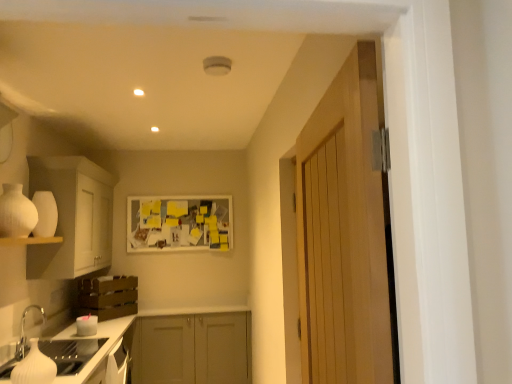
Question: From a real-world perspective, is brown wooden crate at lower left, which appears as the second cabinetry when viewed from the top, physically above wooden door at right?

Choices:
 (A) yes
 (B) no

Answer: (B)

Question: Is brown wooden crate at lower left, which appears as the second cabinetry when viewed from the top, not within wooden door at right?

Choices:
 (A) no
 (B) yes

Answer: (B)

Question: Does brown wooden crate at lower left, which is counted as the second cabinetry, starting from the bottom, appear on the left side of wooden door at right?

Choices:
 (A) yes
 (B) no

Answer: (A)

Question: Can you confirm if brown wooden crate at lower left, which appears as the second cabinetry when viewed from the top, is bigger than wooden door at right?

Choices:
 (A) yes
 (B) no

Answer: (B)

Question: From a real-world perspective, is white glossy sink at lower left physically located above or below white matte cabinet at left, which is the first cabinetry in top-to-bottom order?

Choices:
 (A) below
 (B) above

Answer: (A)

Question: In the image, is white glossy sink at lower left on the left side or the right side of white matte cabinet at left, which is the first cabinetry in top-to-bottom order?

Choices:
 (A) left
 (B) right

Answer: (B)

Question: Is white glossy sink at lower left in front of or behind white matte cabinet at left, which is the first cabinetry in top-to-bottom order, in the image?

Choices:
 (A) behind
 (B) front

Answer: (B)

Question: Is point (31, 374) positioned closer to the camera than point (37, 271)?

Choices:
 (A) farther
 (B) closer

Answer: (B)

Question: Considering the positions of point (155, 225) and point (2, 240), is point (155, 225) closer or farther from the camera than point (2, 240)?

Choices:
 (A) farther
 (B) closer

Answer: (A)

Question: From a real-world perspective, is yellow paper at center positioned above or below white matte shelf at lower left?

Choices:
 (A) above
 (B) below

Answer: (A)

Question: In the image, is yellow paper at center positioned in front of or behind white matte shelf at lower left?

Choices:
 (A) behind
 (B) front

Answer: (A)

Question: Looking at their shapes, would you say yellow paper at center is wider or thinner than white matte shelf at lower left?

Choices:
 (A) thin
 (B) wide

Answer: (A)

Question: From a real-world perspective, relative to white glossy countertop at lower left, is white matte vase at left vertically above or below?

Choices:
 (A) below
 (B) above

Answer: (B)

Question: Is white matte vase at left taller or shorter than white glossy countertop at lower left?

Choices:
 (A) short
 (B) tall

Answer: (A)